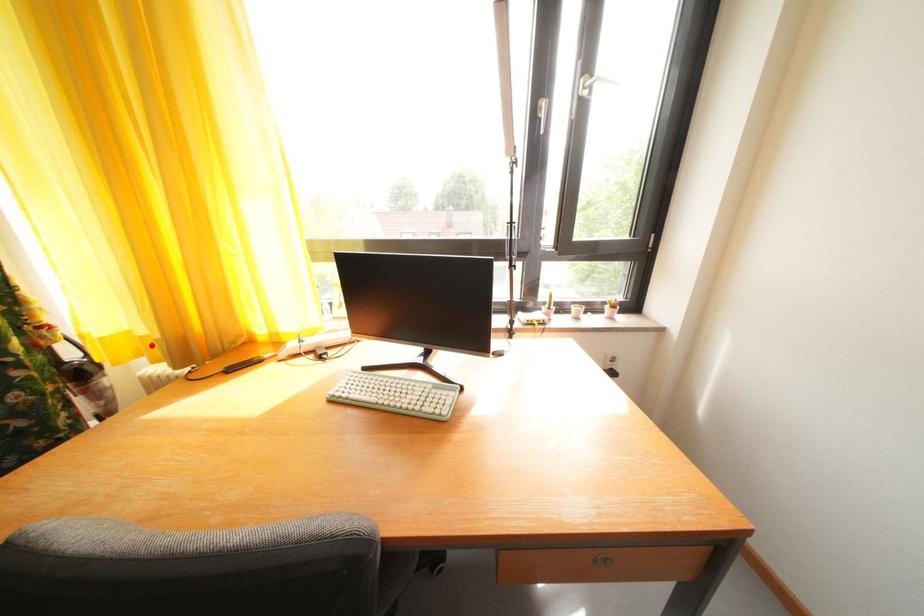
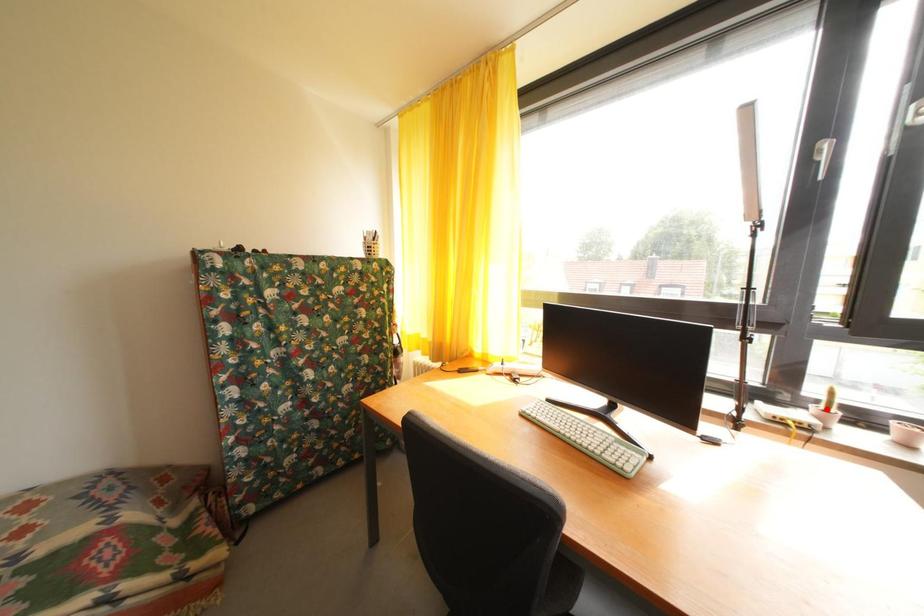
I am providing you with two images of the same scene from different viewpoints. A red point is marked on the first image and another point is marked on the second image. Are the points marked in image1 and image2 representing the same 3D position?

No